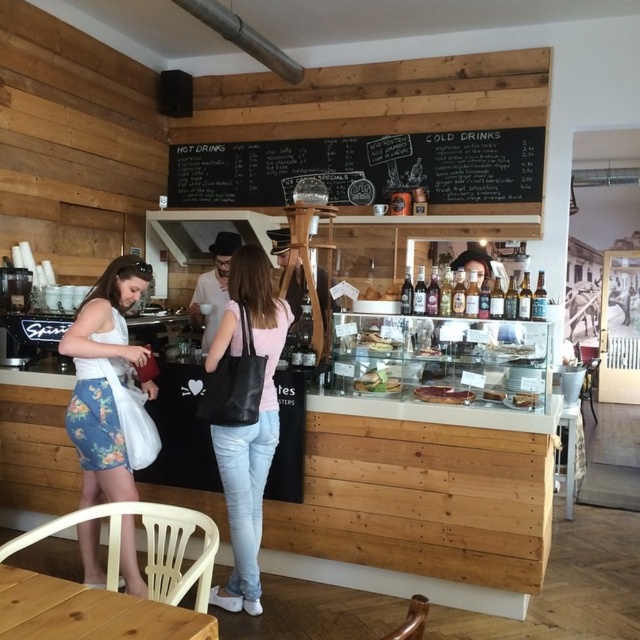
Does black chalkboard at upper center appear on the right side of matte brown pastry at center?

Result: In fact, black chalkboard at upper center is to the left of matte brown pastry at center.

You are a GUI agent. You are given a task and a screenshot of the screen. Output one action in this format:
    pyautogui.click(x=<x>, y=<y>)
    Task: Click on the black chalkboard at upper center
    
    Given the screenshot: What is the action you would take?
    pyautogui.click(x=362, y=168)

What are the coordinates of `black chalkboard at upper center` in the screenshot? It's located at (362, 168).

Is black chalkboard at upper center shorter than green leafy salad at center?

In fact, black chalkboard at upper center may be taller than green leafy salad at center.

Between point (202, 170) and point (374, 385), which one is positioned behind?

Positioned behind is point (202, 170).

Where is `black chalkboard at upper center`? This screenshot has width=640, height=640. black chalkboard at upper center is located at coordinates (362, 168).

Looking at this image, who is more forward, (129, 476) or (244, 278)?

Positioned in front is point (244, 278).

Is floral denim skirt at lower left taller than matte black tote bag at center?

No, floral denim skirt at lower left is not taller than matte black tote bag at center.

Is point (97, 550) in front of point (246, 256)?

No, it is not.

I want to click on floral denim skirt at lower left, so click(104, 380).